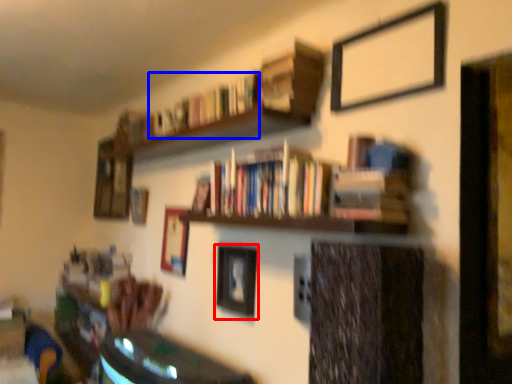
Question: Which point is closer to the camera, picture frame (highlighted by a red box) or book (highlighted by a blue box)?

Choices:
 (A) picture frame
 (B) book

Answer: (B)